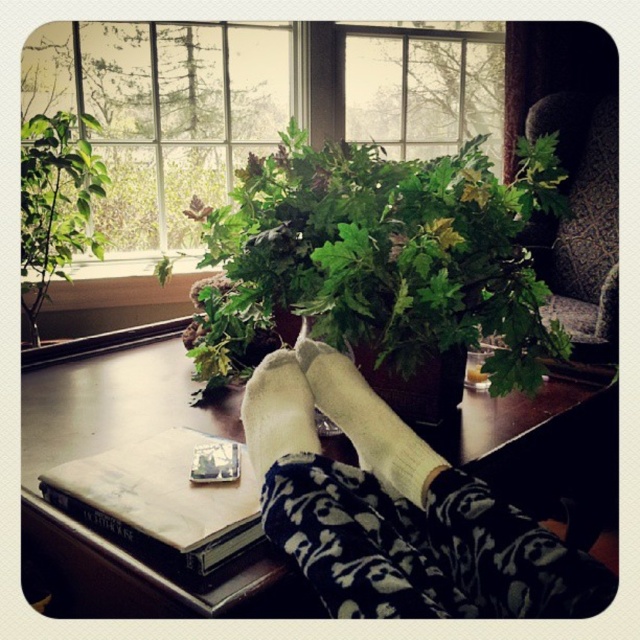
You are a delivery robot entering a living room. You need to place a package on the table where the white sock at lower center is resting. To avoid hitting the green leafy plant at left, which is above the sock, should you approach the table from the right side or the left side?

The green leafy plant at left is located above the white sock at lower center. To avoid hitting the plant, you should approach the table from the right side where there is no obstruction.

You are a person sitting on the floor, and you want to reach the transparent glass window at upper center to open it. However, you are currently holding the hardcover book at lower left. Can you stand up and reach the window without dropping the book?

The transparent glass window at upper center is taller than the hardcover book at lower left. Since the window is higher, you can stand up while holding the hardcover book at lower left and still reach the window.